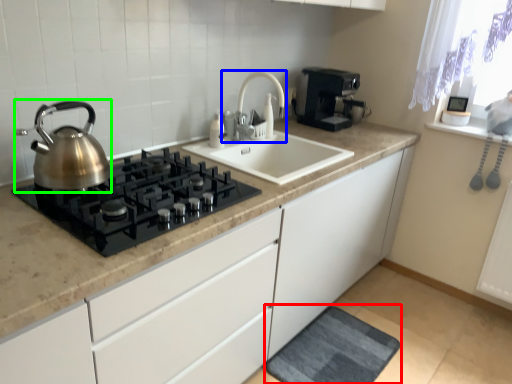
Question: Which is farther away from bath mat (highlighted by a red box)? tap (highlighted by a blue box) or kettle (highlighted by a green box)?

Choices:
 (A) tap
 (B) kettle

Answer: (B)